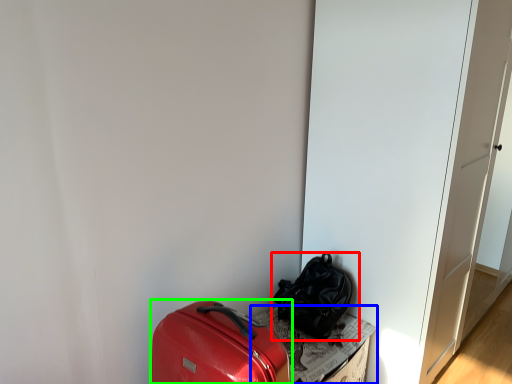
Question: Estimate the real-world distances between objects in this image. Which object is closer to luggage and bags (highlighted by a red box), cardboard box (highlighted by a blue box) or luggage and bags (highlighted by a green box)?

Choices:
 (A) cardboard box
 (B) luggage and bags

Answer: (A)